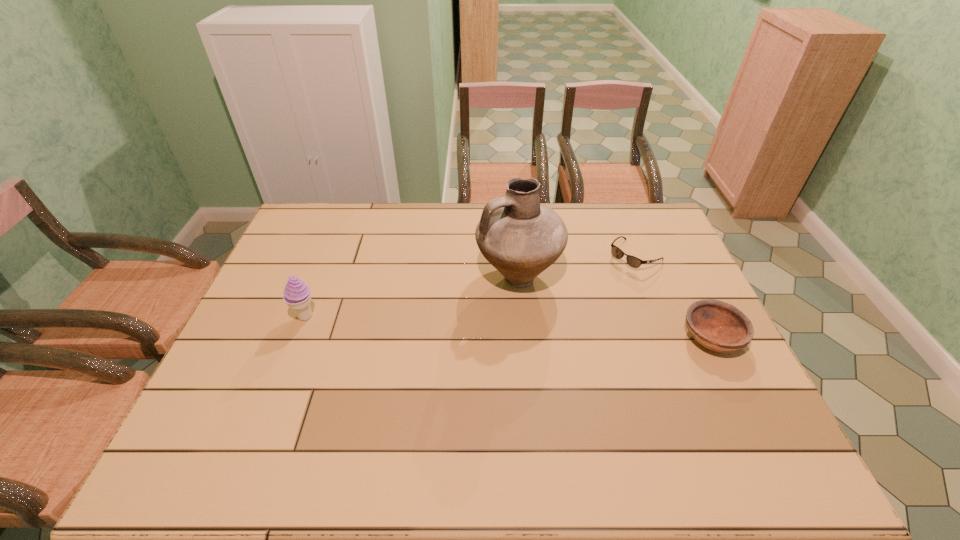
Where is `vacant area at the near edge of the desktop`? This screenshot has height=540, width=960. vacant area at the near edge of the desktop is located at coordinates (642, 416).

Locate an element on the screen. The height and width of the screenshot is (540, 960). vacant space at the left edge of the desktop is located at coordinates (297, 321).

In the image, there is a desktop. Identify the location of vacant area at the right edge. The height and width of the screenshot is (540, 960). 658,271.

At what (x,y) coordinates should I click in order to perform the action: click on vacant region at the far left corner of the desktop. Please return your answer as a coordinate pair (x, y). The height and width of the screenshot is (540, 960). Looking at the image, I should click on [x=305, y=242].

This screenshot has height=540, width=960. In the image, there is a desktop. Identify the location of vacant space at the near right corner. (756, 402).

Where is `free space between the sunglasses and the icecream`? The image size is (960, 540). free space between the sunglasses and the icecream is located at coordinates (470, 286).

This screenshot has height=540, width=960. Find the location of `empty location between the shortest object and the bowl`. empty location between the shortest object and the bowl is located at coordinates (673, 296).

Locate an element on the screen. The width and height of the screenshot is (960, 540). free space between the bowl and the pitcher is located at coordinates (614, 307).

Find the location of `unoccupied area between the tallest object and the leftmost object`. unoccupied area between the tallest object and the leftmost object is located at coordinates tap(412, 296).

Identify the location of free point between the bowl and the second object from left to right. coord(614,307).